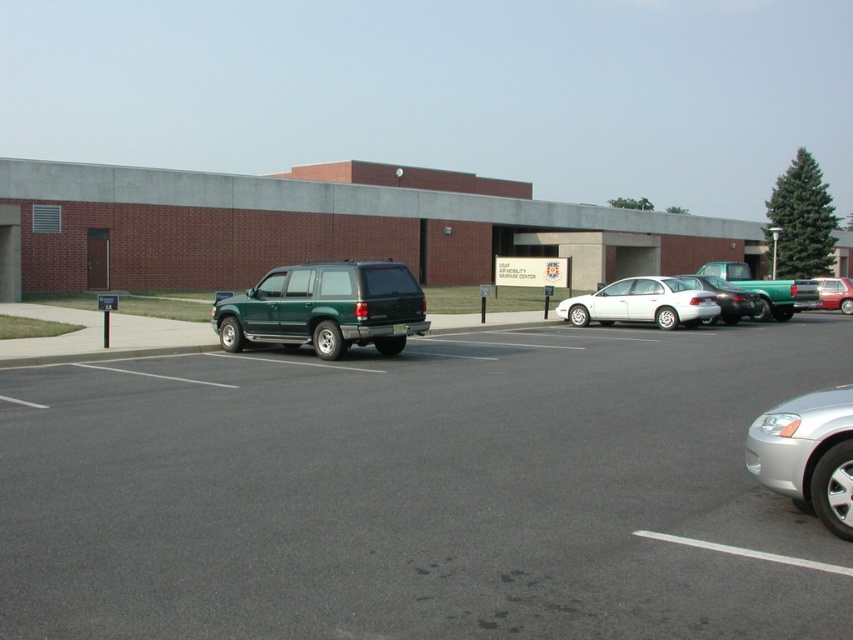
You are a visitor trying to exit the parking lot and need to move your vehicle. Which vehicle, the silver metallic sedan at lower right or the green matte truck at right, must you move first to allow the other to exit?

The silver metallic sedan at lower right is in front of the green matte truck at right, so you must move the silver metallic sedan at lower right first to allow the green matte truck at right to exit.